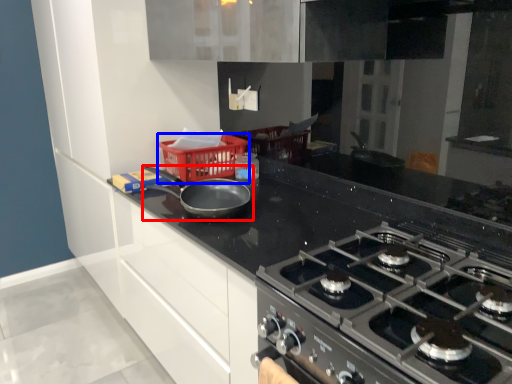
Question: Which of the following is the closest to the observer, kitchen appliance (highlighted by a red box) or basket (highlighted by a blue box)?

Choices:
 (A) kitchen appliance
 (B) basket

Answer: (A)